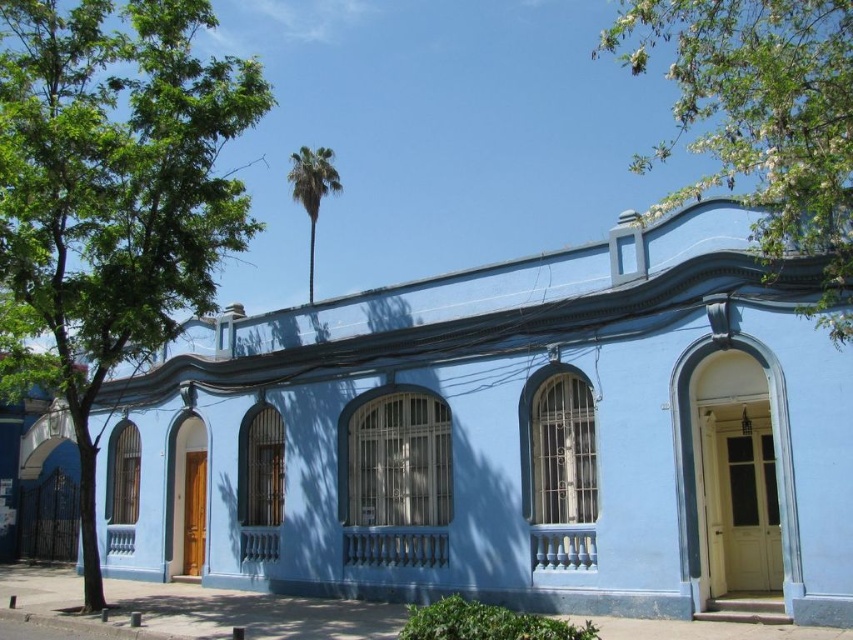
Question: Estimate the real-world distances between objects in this image. Which object is farther from the green leafy tree at left?

Choices:
 (A) green leafy palm at upper center
 (B) green leafy tree at upper right

Answer: (A)

Question: Which object is positioned closest to the green leafy tree at upper right?

Choices:
 (A) green leafy tree at left
 (B) green leafy palm at upper center

Answer: (A)

Question: From the image, what is the correct spatial relationship of green leafy tree at left in relation to green leafy palm at upper center?

Choices:
 (A) right
 (B) left

Answer: (B)

Question: Is green leafy tree at left bigger than green leafy tree at upper right?

Choices:
 (A) yes
 (B) no

Answer: (A)

Question: Does green leafy tree at upper right appear under green leafy palm at upper center?

Choices:
 (A) no
 (B) yes

Answer: (A)

Question: Which object appears closest to the camera in this image?

Choices:
 (A) green leafy palm at upper center
 (B) green leafy tree at upper right
 (C) green leafy tree at left

Answer: (B)